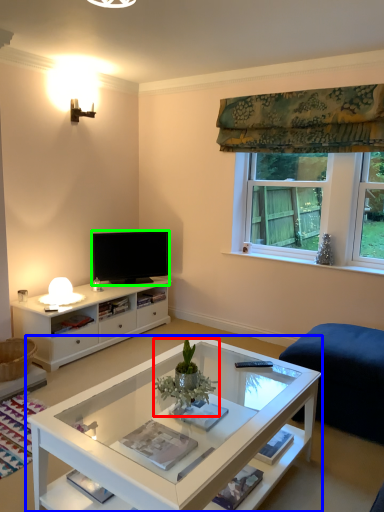
Question: Considering the real-world distances, which object is farthest from houseplant (highlighted by a red box)? coffee table (highlighted by a blue box) or television (highlighted by a green box)?

Choices:
 (A) coffee table
 (B) television

Answer: (B)